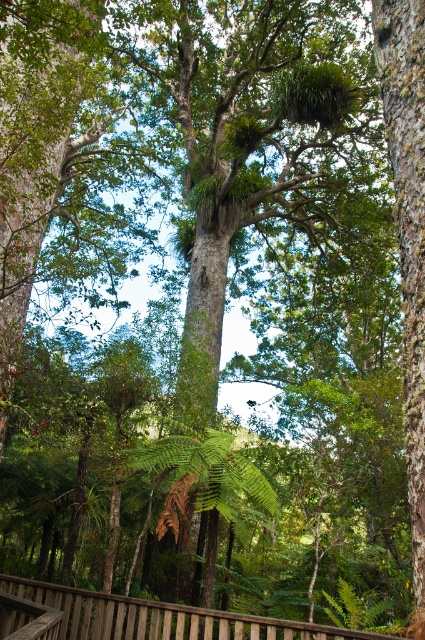
Does rough bark tree at right have a greater height compared to green leafy fern at center?

Indeed, rough bark tree at right has a greater height compared to green leafy fern at center.

Between rough bark tree at right and green leafy fern at center, which one is positioned higher?

rough bark tree at right

Is point (422, 84) positioned in front of point (255, 486)?

No, it is behind (255, 486).

Image resolution: width=425 pixels, height=640 pixels. I want to click on rough bark tree at right, so click(408, 230).

Does brown wooden rail at lower center have a lesser height compared to green leafy fern at center?

No, brown wooden rail at lower center is not shorter than green leafy fern at center.

Image resolution: width=425 pixels, height=640 pixels. Describe the element at coordinates (161, 618) in the screenshot. I see `brown wooden rail at lower center` at that location.

Identify the location of brown wooden rail at lower center. (161, 618).

Is point (419, 408) more distant than point (107, 632)?

No.

Identify the location of rough bark tree at right. This screenshot has height=640, width=425. (408, 230).

Find the location of a particular element. rough bark tree at right is located at coordinates (408, 230).